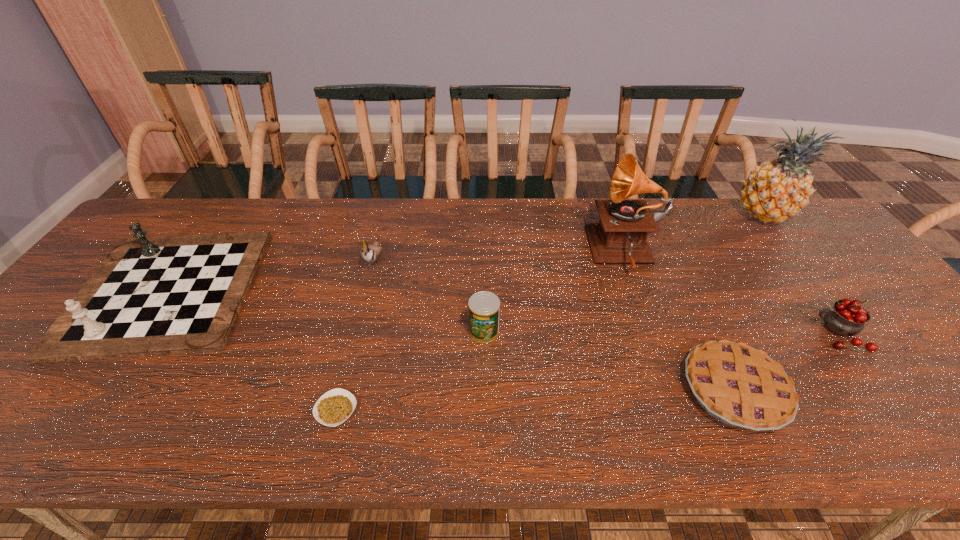
At what (x,y) coordinates should I click in order to perform the action: click on free space between the phonograph record and the fifth object from right to left. Please return your answer as a coordinate pair (x, y). The height and width of the screenshot is (540, 960). Looking at the image, I should click on (555, 292).

In order to click on free spot between the phonograph record and the cherry in this screenshot , I will do `click(732, 293)`.

You are a GUI agent. You are given a task and a screenshot of the screen. Output one action in this format:
    pyautogui.click(x=<x>, y=<y>)
    Task: Click on the free point between the bird and the phonograph record
    Image resolution: width=960 pixels, height=540 pixels.
    Given the screenshot: What is the action you would take?
    pyautogui.click(x=500, y=255)

Identify which object is the seventh nearest to the bird. Please provide its 2D coordinates. Your answer should be formatted as a tuple, i.e. [(x, y)], where the tuple contains the x and y coordinates of a point satisfying the conditions above.

[(847, 317)]

Identify the location of the seventh closest object relative to the pie. (151, 296).

Find the location of a particular element. The height and width of the screenshot is (540, 960). vacant space that satisfies the following two spatial constraints: 1. on the back side of the shortest object; 2. on the left side of the pineapple is located at coordinates (386, 215).

You are a GUI agent. You are given a task and a screenshot of the screen. Output one action in this format:
    pyautogui.click(x=<x>, y=<y>)
    Task: Click on the free space that satisfies the following two spatial constraints: 1. on the horn of the pie; 2. on the right side of the phonograph record
    The width and height of the screenshot is (960, 540).
    Given the screenshot: What is the action you would take?
    pyautogui.click(x=676, y=390)

Where is `vacant region that satisfies the following two spatial constraints: 1. on the horn of the phonograph record; 2. on the handle side of the cherry`? The width and height of the screenshot is (960, 540). vacant region that satisfies the following two spatial constraints: 1. on the horn of the phonograph record; 2. on the handle side of the cherry is located at coordinates (656, 334).

The width and height of the screenshot is (960, 540). I want to click on free location that satisfies the following two spatial constraints: 1. on the horn of the phonograph record; 2. at the face of the bird, so click(629, 259).

The height and width of the screenshot is (540, 960). Find the location of `free region that satisfies the following two spatial constraints: 1. on the back side of the pie; 2. on the handle side of the cherry`. free region that satisfies the following two spatial constraints: 1. on the back side of the pie; 2. on the handle side of the cherry is located at coordinates (708, 334).